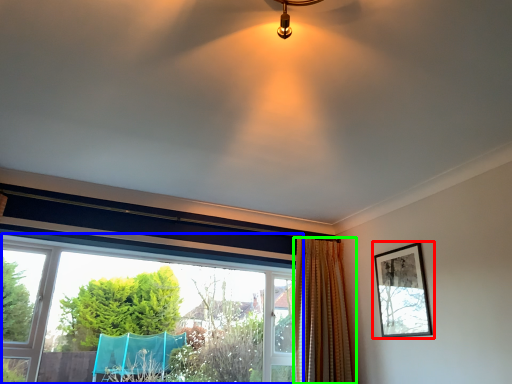
Question: Based on their relative distances, which object is nearer to picture frame (highlighted by a red box)? Choose from window (highlighted by a blue box) and curtain (highlighted by a green box).

Choices:
 (A) window
 (B) curtain

Answer: (B)